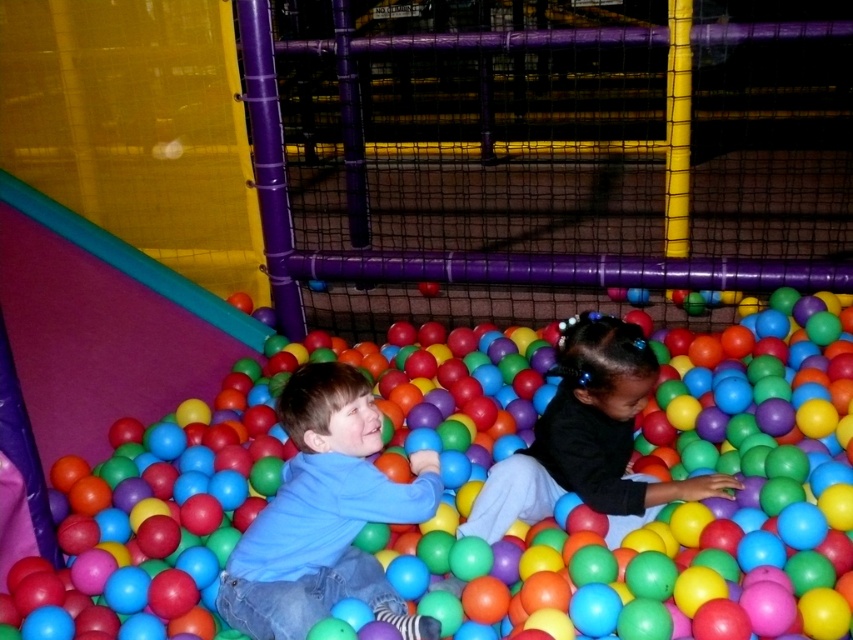
You are a parent trying to ensure your child can safely reach the rubber ball pit at center while wearing a black matte shirt at center. Based on the scene description, can the child comfortably reach into the ball pit without needing to stretch too much?

The rubber ball pit at center is taller than the black matte shirt at center, meaning the ball pit is higher than the child wearing the black matte shirt. Therefore, the child would need to stretch upwards to reach into the ball pit, which might require some effort.

You are standing at point (498, 592) and want to reach the exit door located at point 0.585, 0.925. The path between them is blocked by a large inflatable obstacle. Can you go around it by moving to the left or right side? Please explain your reasoning based on the distance between the two points.

The distance between point (498, 592) and point 0.585, 0.925 is 1.92 meters. Since the path is blocked by an inflatable obstacle, you can go around either side as long as there is enough space. However, the exact feasibility depends on the obstacle size and the available clearance, which isn,t specified here.

You are a parent trying to ensure your child can move freely in the play area. Given that the rubber ball pit at center takes up more space than the blue matte shirt at center, which object would you need to avoid stepping on to prevent disturbing the child?

The rubber ball pit at center has a larger size compared to the blue matte shirt at center, so you should avoid stepping on the rubber ball pit at center to prevent disturbing the child since it occupies more space and could cause more disruption.